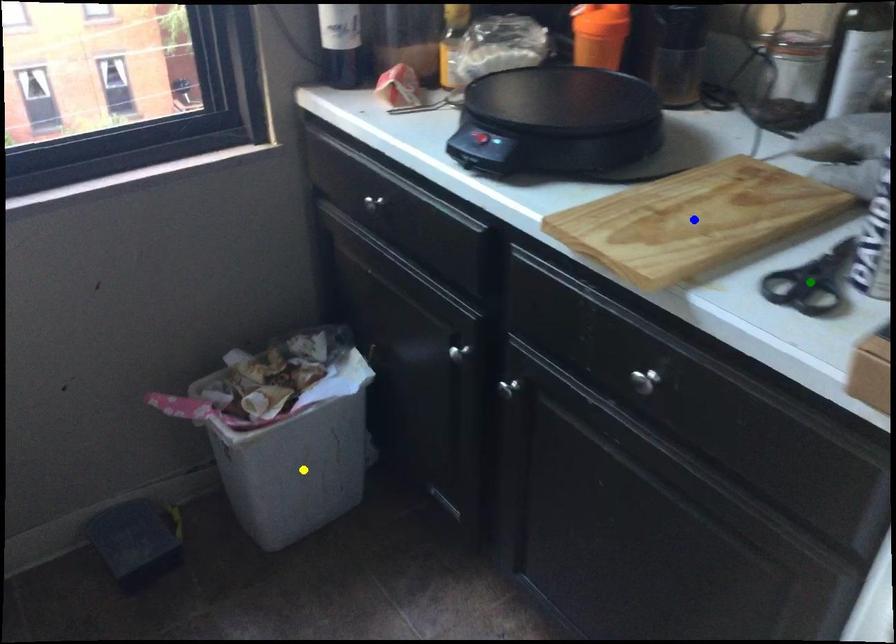
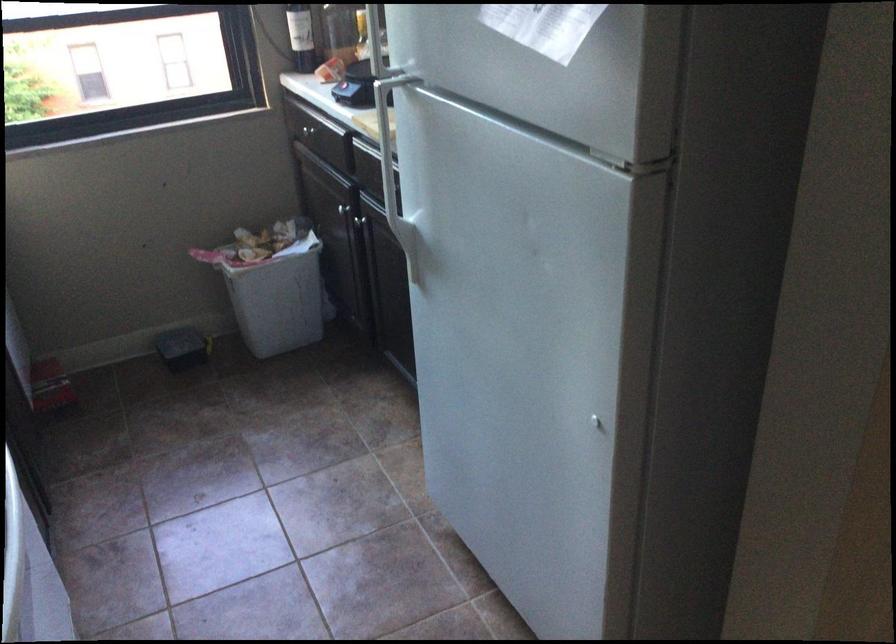
I am providing you with two images of the same scene from different viewpoints. Three points are marked in image1. Which point corresponds to a part or object that is occluded in image2?In image1, three points are marked. Which of them correspond to a part or object that is occluded in image2?Among the three points shown in image1, which one corresponds to a part or object that is no longer visible due to occlusion in image2?

blue point, green point